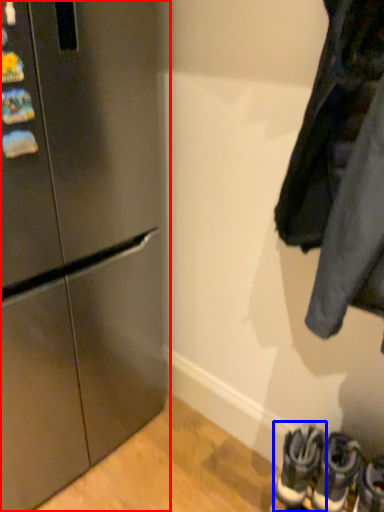
Question: Among these objects, which one is farthest to the camera, refrigerator (highlighted by a red box) or footwear (highlighted by a blue box)?

Choices:
 (A) refrigerator
 (B) footwear

Answer: (B)